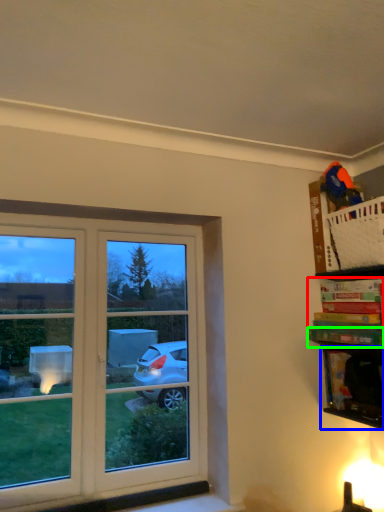
Question: Considering the real-world distances, which object is farthest from book (highlighted by a red box)? cabinet (highlighted by a blue box) or book (highlighted by a green box)?

Choices:
 (A) cabinet
 (B) book

Answer: (A)